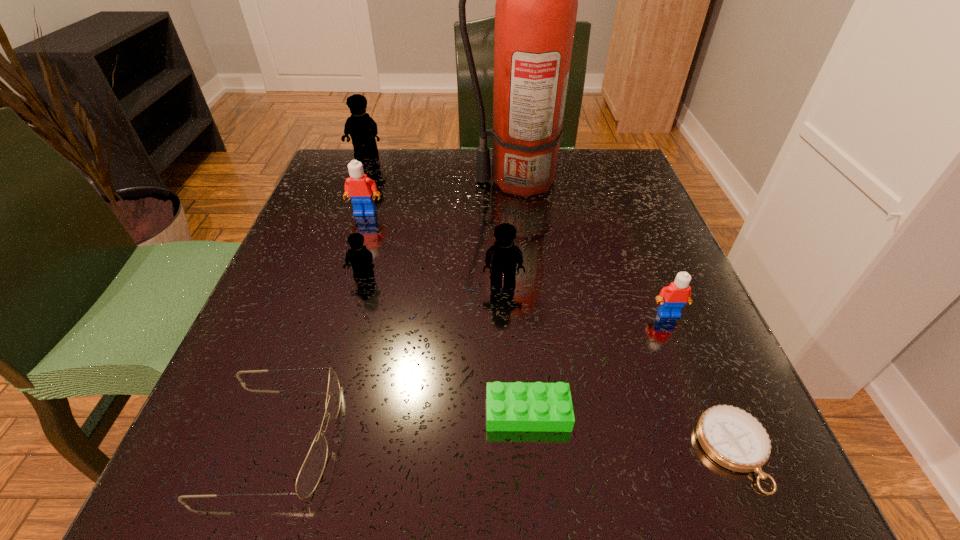
This screenshot has height=540, width=960. In order to click on fire extinguisher in this screenshot , I will do `click(536, 6)`.

Find the location of a particular element. This screenshot has width=960, height=540. the tallest object is located at coordinates (536, 6).

Identify the location of the tallest Lego. The width and height of the screenshot is (960, 540). (362, 128).

Locate an element on the screen. The width and height of the screenshot is (960, 540). the eighth shortest object is located at coordinates (362, 128).

The width and height of the screenshot is (960, 540). I want to click on the bigger white Lego, so tap(359, 188).

Locate an element on the screen. The image size is (960, 540). the third farthest object is located at coordinates (359, 188).

Find the location of a particular element. the second smallest yellow Lego is located at coordinates (503, 256).

You are a GUI agent. You are given a task and a screenshot of the screen. Output one action in this format:
    pyautogui.click(x=<x>, y=<y>)
    Task: Click on the smallest yellow Lego
    The image size is (960, 540).
    Given the screenshot: What is the action you would take?
    click(x=360, y=258)

At what (x,y) coordinates should I click in order to perform the action: click on the smaller white Lego. Please return your answer as a coordinate pair (x, y). This screenshot has width=960, height=540. Looking at the image, I should click on (672, 298).

Where is `the fourth nearest object`? the fourth nearest object is located at coordinates (672, 298).